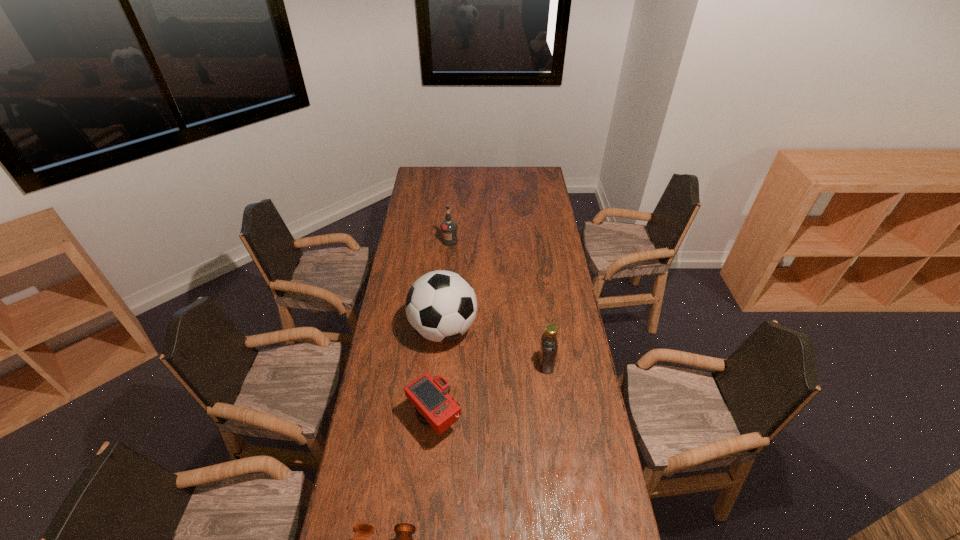
Identify the location of free space between the soccer ball and the right vodka. (494, 347).

The width and height of the screenshot is (960, 540). What are the coordinates of `vacant space in between the soccer ball and the second nearest object` in the screenshot? It's located at (439, 374).

Locate which object ranks second in proximity to the rightmost object. Please provide its 2D coordinates. Your answer should be formatted as a tuple, i.e. [(x, y)], where the tuple contains the x and y coordinates of a point satisfying the conditions above.

[(434, 407)]

This screenshot has height=540, width=960. In order to click on object that stands as the third closest to the nearer vodka in this screenshot , I will do `click(362, 539)`.

Locate an element on the screen. This screenshot has width=960, height=540. blank space that satisfies the following two spatial constraints: 1. on the back side of the soccer ball; 2. on the left side of the camera is located at coordinates (443, 329).